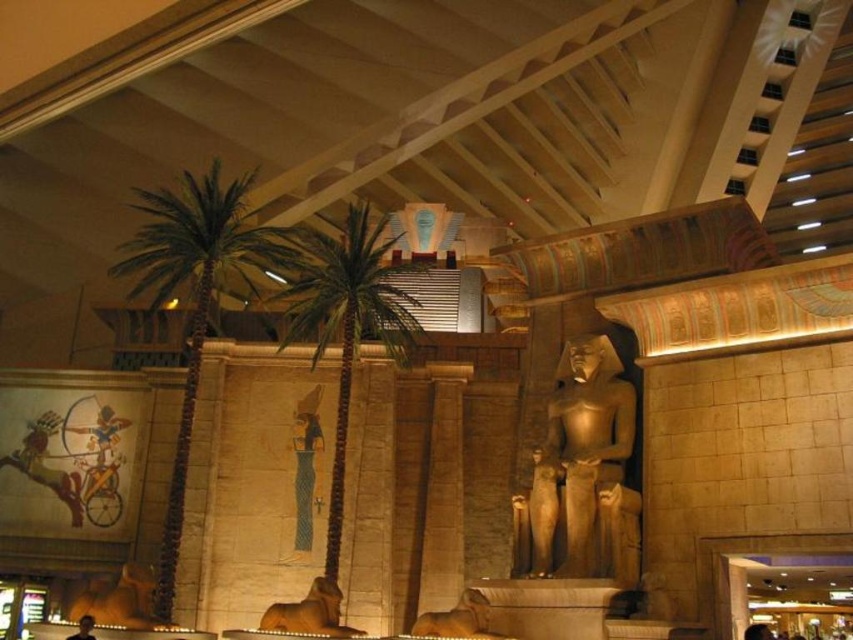
Question: Which of the following is the closest to the observer?

Choices:
 (A) brown stone statue at lower center
 (B) golden stone statue at center
 (C) brown stone elephant at lower center

Answer: (A)

Question: Which point is closer to the camera?

Choices:
 (A) (585, 339)
 (B) (434, 620)

Answer: (B)

Question: Does green leafy palm tree at left appear over green leafy palm tree at center?

Choices:
 (A) no
 (B) yes

Answer: (A)

Question: From the image, what is the correct spatial relationship of brown stone elephant at lower center in relation to brown stone statue at lower center?

Choices:
 (A) right
 (B) left

Answer: (B)

Question: Which of the following is the closest to the observer?

Choices:
 (A) brown stone elephant at lower center
 (B) green leafy palm tree at left

Answer: (A)

Question: Is golden stone statue at center positioned before brown stone statue at lower center?

Choices:
 (A) yes
 (B) no

Answer: (B)